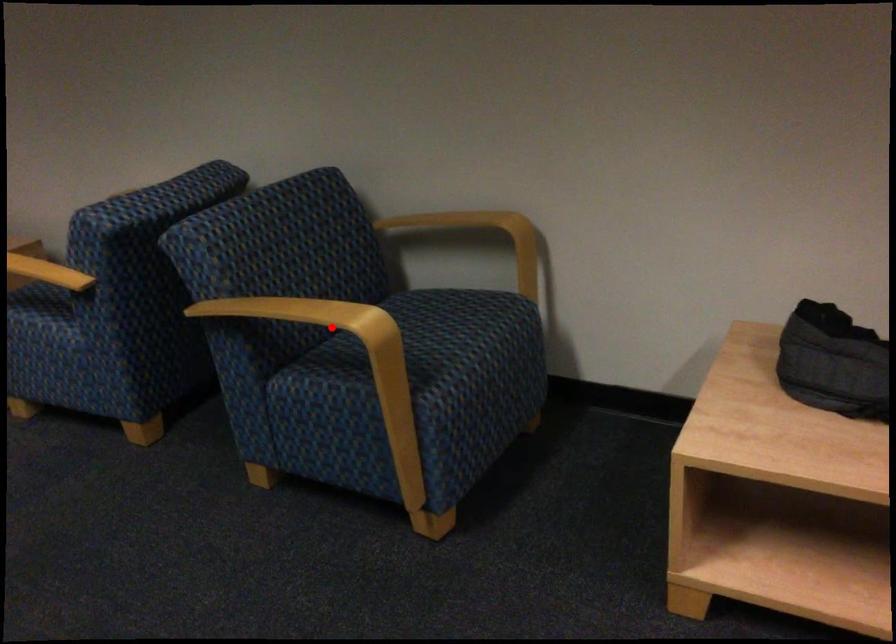
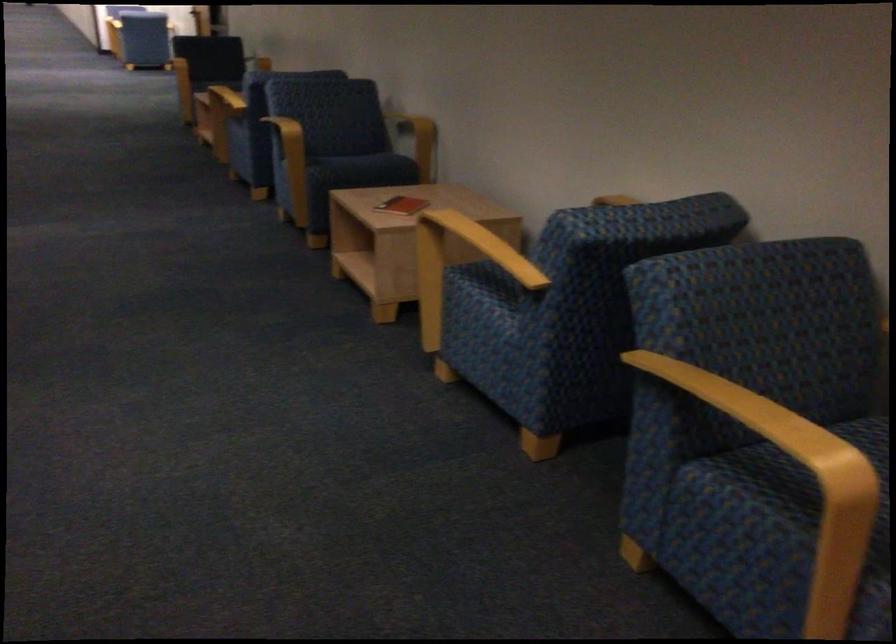
Question: I am providing you with two images of the same scene from different viewpoints. Given a red point in image1, look at the same physical point in image2. Is it:

Choices:
 (A) Closer to the viewpoint
 (B) Farther from the viewpoint

Answer: (A)